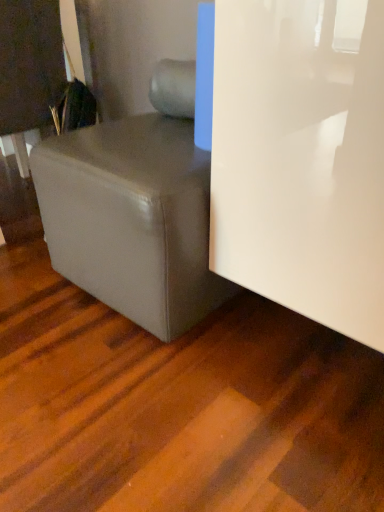
Question: Is matte gray ottoman at lower left next to matte black book at upper left?

Choices:
 (A) yes
 (B) no

Answer: (B)

Question: Is matte gray ottoman at lower left not near matte black book at upper left?

Choices:
 (A) yes
 (B) no

Answer: (B)

Question: Is matte gray ottoman at lower left completely or partially outside of matte black book at upper left?

Choices:
 (A) yes
 (B) no

Answer: (A)

Question: From a real-world perspective, is matte gray ottoman at lower left positioned over matte black book at upper left based on gravity?

Choices:
 (A) no
 (B) yes

Answer: (A)

Question: From a real-world perspective, is matte gray ottoman at lower left positioned under matte black book at upper left based on gravity?

Choices:
 (A) yes
 (B) no

Answer: (A)

Question: Is matte gray ottoman at lower left shorter than matte black book at upper left?

Choices:
 (A) no
 (B) yes

Answer: (B)

Question: Does white glossy door at right have a greater width compared to matte gray ottoman at lower left?

Choices:
 (A) yes
 (B) no

Answer: (B)

Question: Does white glossy door at right contain matte gray ottoman at lower left?

Choices:
 (A) no
 (B) yes

Answer: (A)

Question: Is white glossy door at right at the left side of matte gray ottoman at lower left?

Choices:
 (A) no
 (B) yes

Answer: (A)

Question: Can you confirm if white glossy door at right is taller than matte gray ottoman at lower left?

Choices:
 (A) no
 (B) yes

Answer: (B)

Question: Is white glossy door at right positioned behind matte gray ottoman at lower left?

Choices:
 (A) yes
 (B) no

Answer: (B)

Question: Considering the relative sizes of white glossy door at right and matte gray ottoman at lower left in the image provided, is white glossy door at right thinner than matte gray ottoman at lower left?

Choices:
 (A) yes
 (B) no

Answer: (A)

Question: Considering the relative positions of white glossy door at right and matte black book at upper left in the image provided, is white glossy door at right to the right of matte black book at upper left from the viewer's perspective?

Choices:
 (A) yes
 (B) no

Answer: (A)